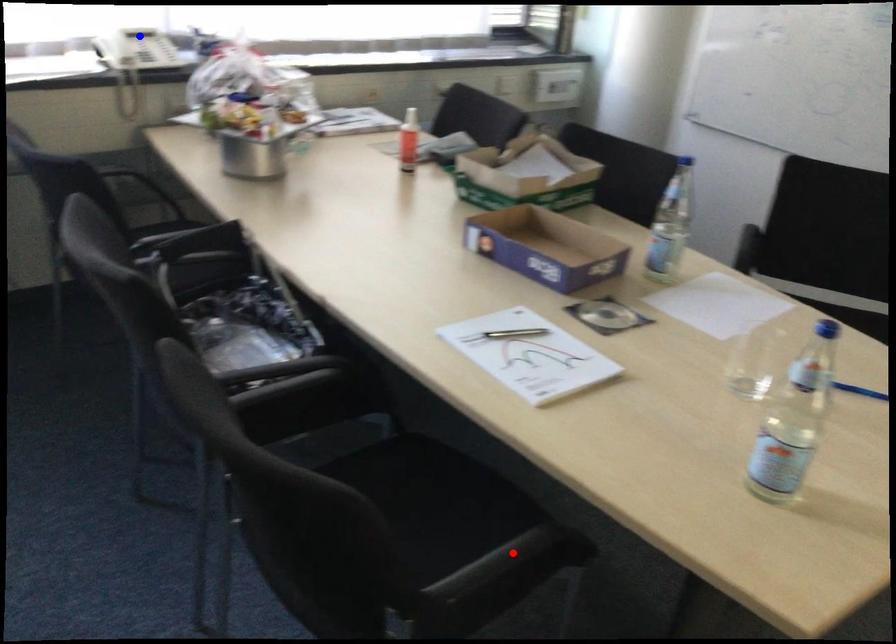
Question: Two points are marked on the image. Which point is closer to the camera?

Choices:
 (A) Blue point is closer.
 (B) Red point is closer.

Answer: (B)